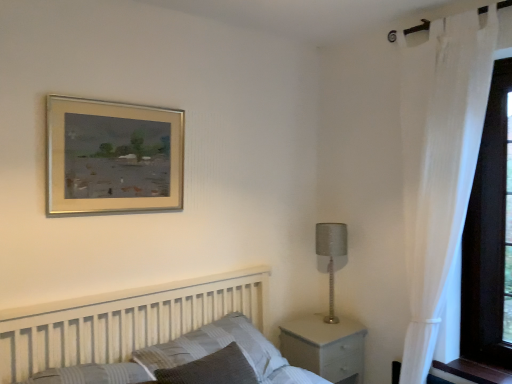
Question: Is point (331, 261) closer or farther from the camera than point (208, 344)?

Choices:
 (A) closer
 (B) farther

Answer: (B)

Question: Considering the positions of satin silver lamp at right and striped fabric pillow at center in the image, is satin silver lamp at right taller or shorter than striped fabric pillow at center?

Choices:
 (A) tall
 (B) short

Answer: (A)

Question: Which of these objects is positioned closest to the white wooden bed at lower left?

Choices:
 (A) gold metallic picture frame at upper center
 (B) white matte nightstand at lower right
 (C) striped fabric pillow at center
 (D) satin silver lamp at right
 (E) white sheer curtain at right

Answer: (C)

Question: Which of these objects is positioned farthest from the gold metallic picture frame at upper center?

Choices:
 (A) white sheer curtain at right
 (B) white matte nightstand at lower right
 (C) white wooden bed at lower left
 (D) satin silver lamp at right
 (E) striped fabric pillow at center

Answer: (A)